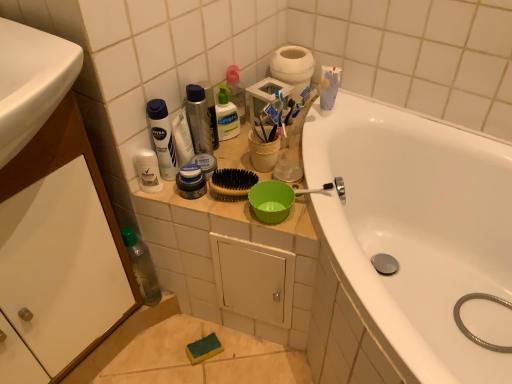
Identify the location of free location to the right of clear plastic shaving cream canister at upper left. This screenshot has height=384, width=512. (216, 193).